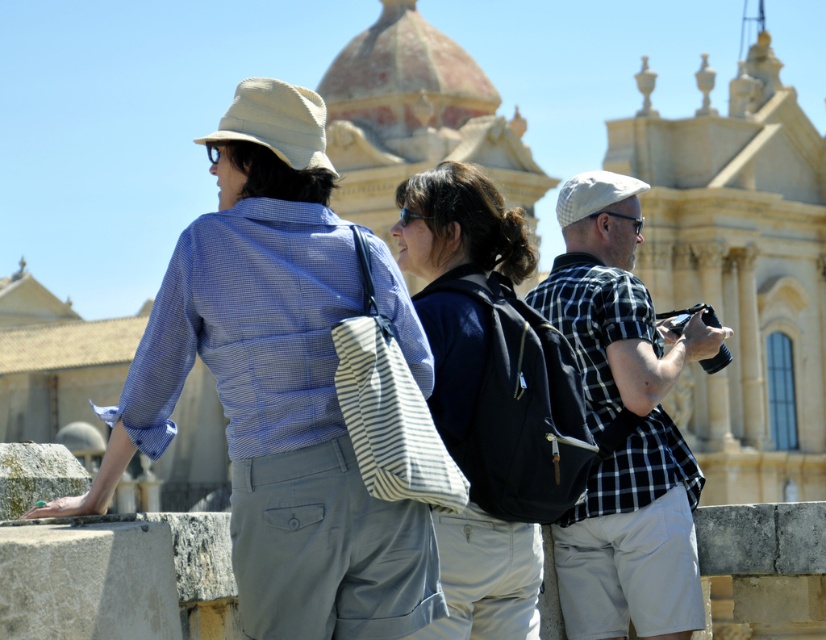
Question: Which object appears farthest from the camera in this image?

Choices:
 (A) matte blue shirt at center
 (B) dark blue backpack at center

Answer: (B)

Question: Does matte blue shirt at center have a greater width compared to checkered fabric shirt at center?

Choices:
 (A) yes
 (B) no

Answer: (A)

Question: Among these points, which one is farthest from the camera?

Choices:
 (A) (587, 541)
 (B) (312, 316)
 (C) (511, 544)

Answer: (A)

Question: Is matte blue shirt at center above checkered fabric shirt at center?

Choices:
 (A) yes
 (B) no

Answer: (B)

Question: Which of the following is the closest to the observer?

Choices:
 (A) (525, 336)
 (B) (317, 376)
 (C) (668, 545)

Answer: (B)

Question: Is the position of dark blue backpack at center more distant than that of checkered fabric shirt at center?

Choices:
 (A) no
 (B) yes

Answer: (A)